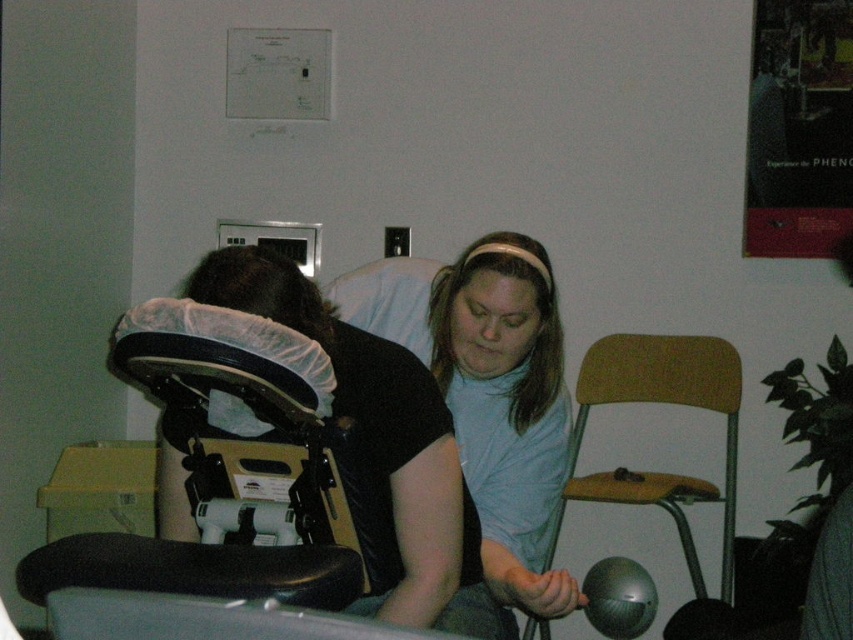
You are a patient in a medical room and need to locate the matte black helmet at center. According to the coordinates provided, where exactly should you look?

The matte black helmet at center is located at point coordinates (380, 440).

You are a physical therapist in the room. You need to move the matte black helmet at center to the right side of the black leather baby carriage at left. Is this possible based on their current positions?

The black leather baby carriage at left is to the left of the matte black helmet at center. Moving the matte black helmet at center to the right side of the black leather baby carriage at left would require placing it further to the left, which contradicts the direction. Therefore, this is not possible with their current spatial arrangement.

You are a physical therapist in the room. You need to place a small round object between the light blue fabric at center and the black leather baby carriage at left. Which object should you place it closer to so that it doesn

The light blue fabric at center is taller than the black leather baby carriage at left, so placing the small round object closer to the light blue fabric at center would allow it to be within reach while maintaining stability.